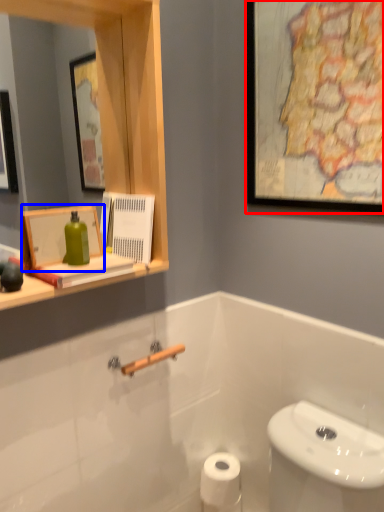
Question: Which object is further to the camera taking this photo, picture frame (highlighted by a red box) or picture frame (highlighted by a blue box)?

Choices:
 (A) picture frame
 (B) picture frame

Answer: (B)